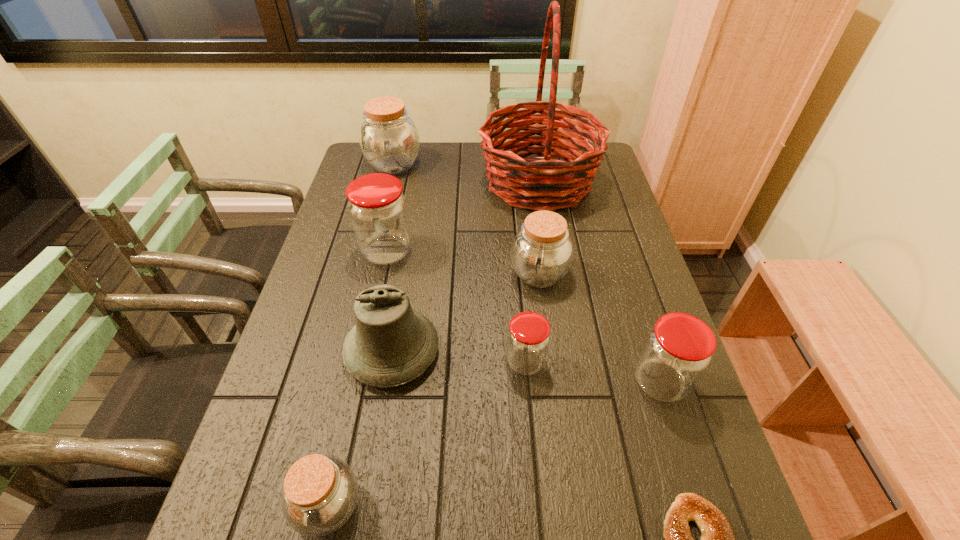
Locate an element on the screen. bell that is at the left edge is located at coordinates (391, 344).

Where is `basket at the right edge`? basket at the right edge is located at coordinates (523, 183).

This screenshot has height=540, width=960. What are the coordinates of `jar at the right edge` in the screenshot? It's located at (677, 351).

This screenshot has width=960, height=540. In order to click on object located in the far left corner section of the desktop in this screenshot , I will do `click(389, 139)`.

You are a GUI agent. You are given a task and a screenshot of the screen. Output one action in this format:
    pyautogui.click(x=<x>, y=<y>)
    Task: Click on the object at the far right corner
    Image resolution: width=960 pixels, height=540 pixels.
    Given the screenshot: What is the action you would take?
    pyautogui.click(x=523, y=183)

This screenshot has height=540, width=960. In order to click on blank space at the far edge of the desktop in this screenshot , I will do `click(460, 156)`.

Identify the location of free space at the left edge of the desktop. The image size is (960, 540). (351, 227).

I want to click on free space at the right edge of the desktop, so click(x=673, y=438).

The height and width of the screenshot is (540, 960). Find the location of `empty location between the second smallest red jar and the smallest red jar`. empty location between the second smallest red jar and the smallest red jar is located at coordinates (592, 372).

Find the location of a particular element. The height and width of the screenshot is (540, 960). vacant area that lies between the farthest jar and the rightmost brown jar is located at coordinates (467, 220).